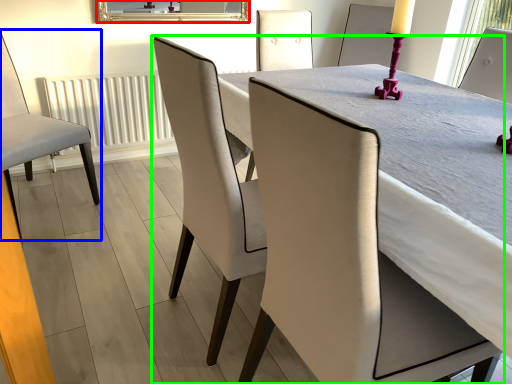
Question: Based on their relative distances, which object is farther from mirror (highlighted by a red box)? Choose from chair (highlighted by a blue box) and chair (highlighted by a green box).

Choices:
 (A) chair
 (B) chair

Answer: (B)